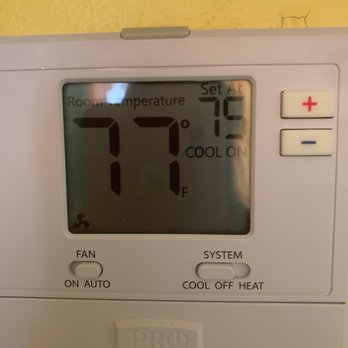
You are a GUI agent. You are given a task and a screenshot of the screen. Output one action in this format:
    pyautogui.click(x=<x>, y=<y>)
    Task: Click on the thermostat
    The width and height of the screenshot is (348, 348).
    Given the screenshot: What is the action you would take?
    pyautogui.click(x=301, y=244)